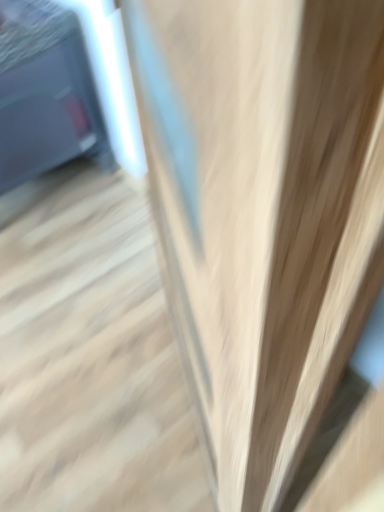
This screenshot has height=512, width=384. I want to click on light wood stairs at center, so click(90, 358).

What do you see at coordinates (90, 358) in the screenshot? I see `light wood stairs at center` at bounding box center [90, 358].

In order to face light wood stairs at center, should I rotate leftwards or rightwards?

To align with it, rotate left about 14.429°.

The width and height of the screenshot is (384, 512). What do you see at coordinates (45, 93) in the screenshot? I see `matte black tv at left` at bounding box center [45, 93].

This screenshot has height=512, width=384. In order to click on matte black tv at left in this screenshot , I will do `click(45, 93)`.

Where is `light wood stairs at center`? This screenshot has height=512, width=384. light wood stairs at center is located at coordinates (90, 358).

Which is more to the left, light wood stairs at center or matte black tv at left?

matte black tv at left is more to the left.

Between light wood stairs at center and matte black tv at left, which one is positioned in front?

light wood stairs at center.

Is point (113, 254) behind point (10, 113)?

Yes, point (113, 254) is behind point (10, 113).

From the image's perspective, does light wood stairs at center appear lower than matte black tv at left?

Yes.

From a real-world perspective, is light wood stairs at center positioned under matte black tv at left based on gravity?

Correct, in the physical world, light wood stairs at center is lower than matte black tv at left.

Does light wood stairs at center have a greater width compared to matte black tv at left?

Yes, light wood stairs at center is wider than matte black tv at left.

Considering the relative sizes of light wood stairs at center and matte black tv at left in the image provided, is light wood stairs at center shorter than matte black tv at left?

Indeed, light wood stairs at center has a lesser height compared to matte black tv at left.

Consider the image. Considering the sizes of objects light wood stairs at center and matte black tv at left in the image provided, who is smaller, light wood stairs at center or matte black tv at left?

light wood stairs at center is smaller.

Is matte black tv at left completely or partially inside light wood stairs at center?

Actually, matte black tv at left is outside light wood stairs at center.

Is light wood stairs at center placed right next to matte black tv at left?

No, light wood stairs at center is not making contact with matte black tv at left.

Is light wood stairs at center looking in the opposite direction of matte black tv at left?

That's not correct — light wood stairs at center is not looking away from matte black tv at left.

How many degrees apart are the facing directions of light wood stairs at center and matte black tv at left?

The facing directions of light wood stairs at center and matte black tv at left are 90.1 degrees apart.

I want to click on stairs located on the right of matte black tv at left, so click(90, 358).

Does matte black tv at left appear on the right side of light wood stairs at center?

Incorrect, matte black tv at left is not on the right side of light wood stairs at center.

Is matte black tv at left behind light wood stairs at center?

Yes, matte black tv at left is further from the viewer.

Does point (30, 48) come farther from viewer compared to point (184, 431)?

Yes.

From the image's perspective, between matte black tv at left and light wood stairs at center, which one is located above?

matte black tv at left is shown above in the image.

From a real-world perspective, is matte black tv at left above or below light wood stairs at center?

matte black tv at left is above light wood stairs at center.

Can you confirm if matte black tv at left is thinner than light wood stairs at center?

Yes, matte black tv at left is thinner than light wood stairs at center.

Does matte black tv at left have a lesser height compared to light wood stairs at center?

No.

Is matte black tv at left bigger or smaller than light wood stairs at center?

matte black tv at left is bigger than light wood stairs at center.

Is matte black tv at left not within light wood stairs at center?

Yes, matte black tv at left is located beyond the bounds of light wood stairs at center.

Is matte black tv at left next to light wood stairs at center and touching it?

No, matte black tv at left is not in contact with light wood stairs at center.

Is light wood stairs at center at the back of matte black tv at left?

That's not correct — matte black tv at left is not looking away from light wood stairs at center.

How distant is matte black tv at left from light wood stairs at center?

matte black tv at left and light wood stairs at center are 25.72 inches apart from each other.

Where is `stairs on the right of matte black tv at left`? This screenshot has width=384, height=512. stairs on the right of matte black tv at left is located at coordinates (90, 358).

I want to click on stairs on the right of the matte black tv at left, so click(90, 358).

At what (x,y) coordinates should I click in order to perform the action: click on stairs located in front of the matte black tv at left. Please return your answer as a coordinate pair (x, y). The height and width of the screenshot is (512, 384). Looking at the image, I should click on (90, 358).